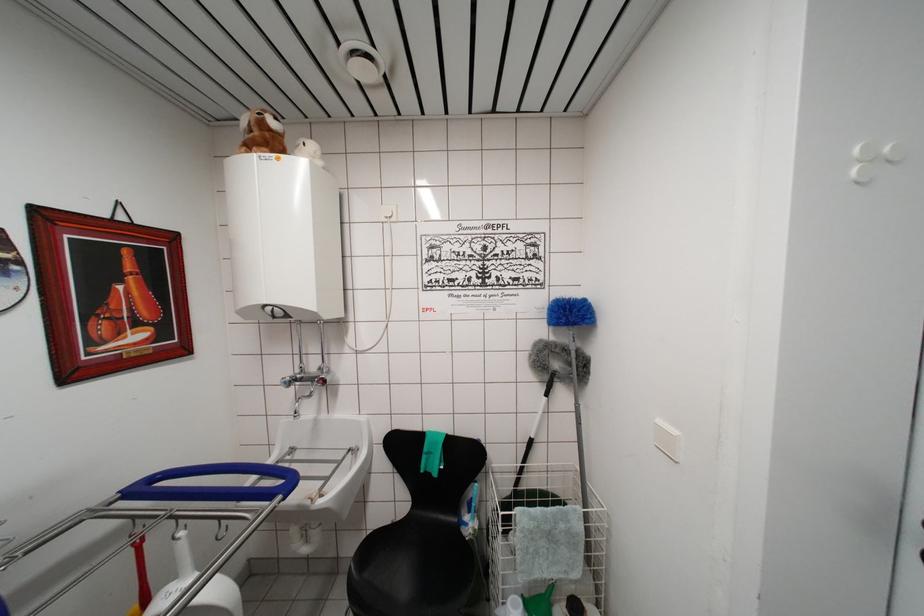
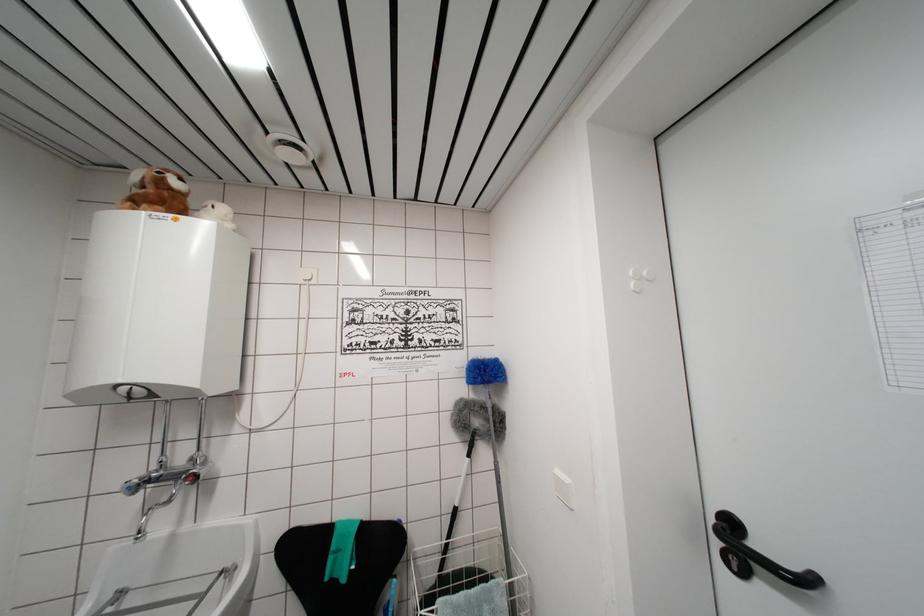
Question: The first image is from the beginning of the video and the second image is from the end. How did the camera likely rotate when shooting the video?

Choices:
 (A) Left
 (B) Right
 (C) Up
 (D) Down

Answer: (B)